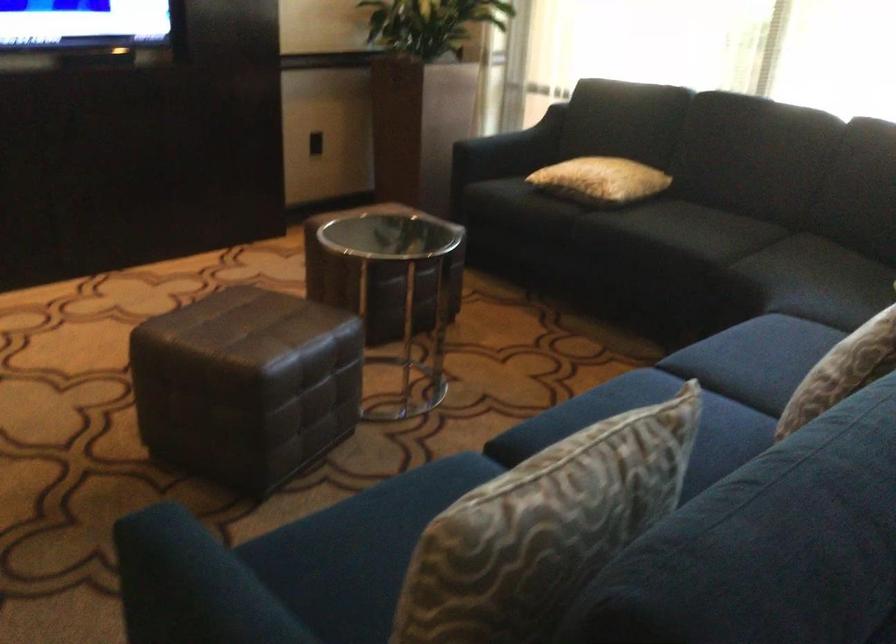
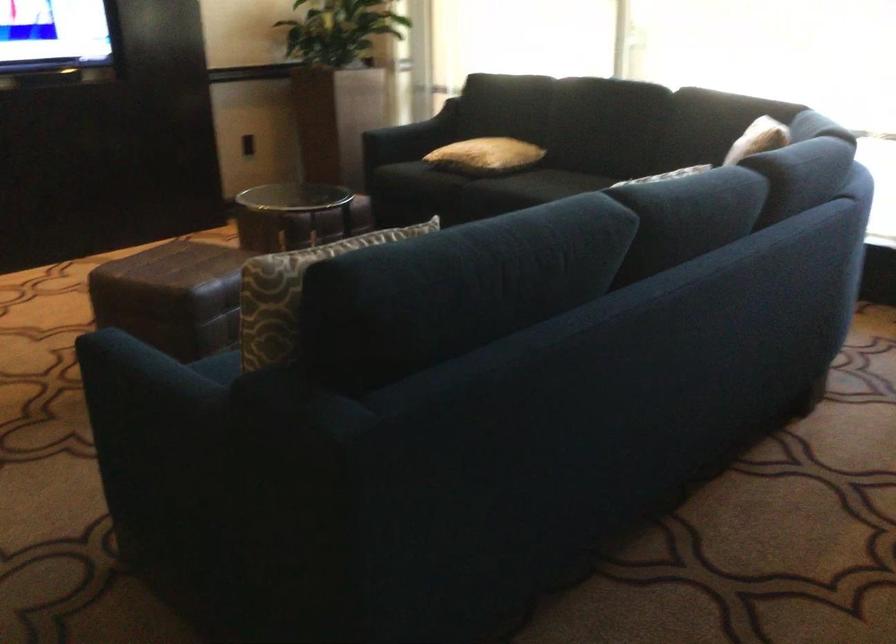
Question: How did the camera likely rotate?

Choices:
 (A) Left
 (B) Right
 (C) Up
 (D) Down

Answer: (C)